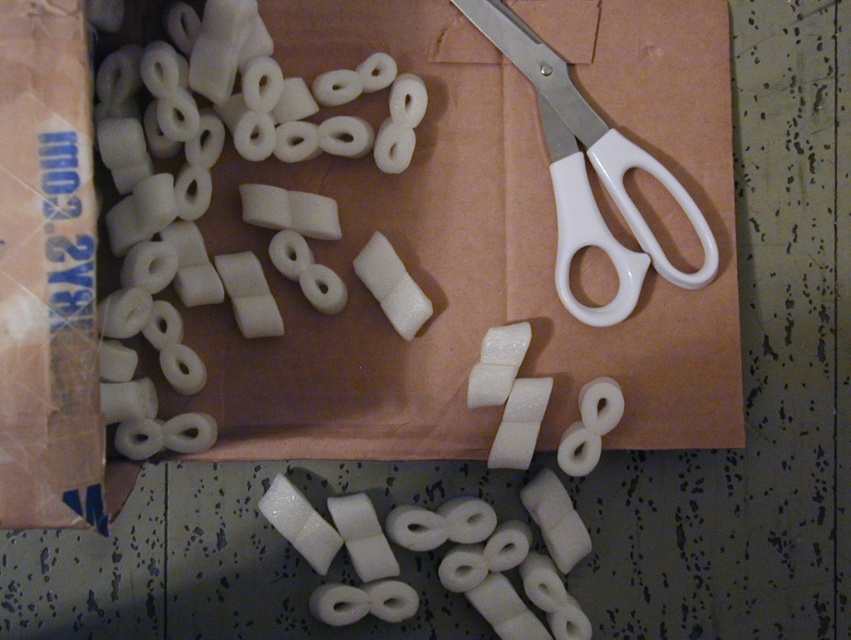
Which is more to the right, matte brown cardboard at upper center or white matte toilet paper at lower center?

white matte toilet paper at lower center

Between point (449, 49) and point (523, 572), which one is positioned in front?

Point (523, 572) is more forward.

The width and height of the screenshot is (851, 640). Identify the location of matte brown cardboard at upper center. (480, 241).

Does point (324, 556) lie in front of point (575, 300)?

Yes, it is in front of point (575, 300).

Between white matte toilet paper at lower center and white plastic scissors at upper right, which one has less height?

With less height is white matte toilet paper at lower center.

What do you see at coordinates (443, 556) in the screenshot?
I see `white matte toilet paper at lower center` at bounding box center [443, 556].

Where is `white matte toilet paper at lower center`? This screenshot has height=640, width=851. white matte toilet paper at lower center is located at coordinates (443, 556).

Locate an element on the screen. The height and width of the screenshot is (640, 851). matte brown cardboard at upper center is located at coordinates (480, 241).

Between matte brown cardboard at upper center and white plastic scissors at upper right, which one is positioned lower?

matte brown cardboard at upper center

Is point (417, 342) closer to viewer compared to point (638, 268)?

No, it is not.

Locate an element on the screen. The image size is (851, 640). matte brown cardboard at upper center is located at coordinates (480, 241).